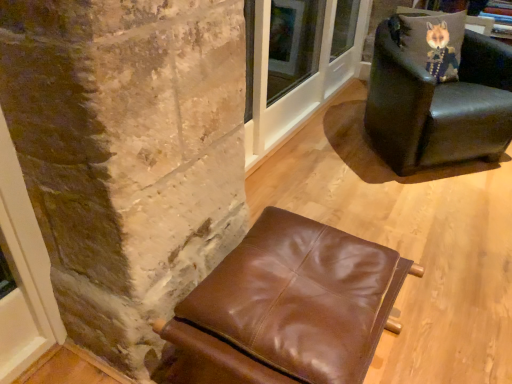
Where is `free space in front of leather armchair at upper right, the 2th chair from the left`? This screenshot has height=384, width=512. free space in front of leather armchair at upper right, the 2th chair from the left is located at coordinates (431, 217).